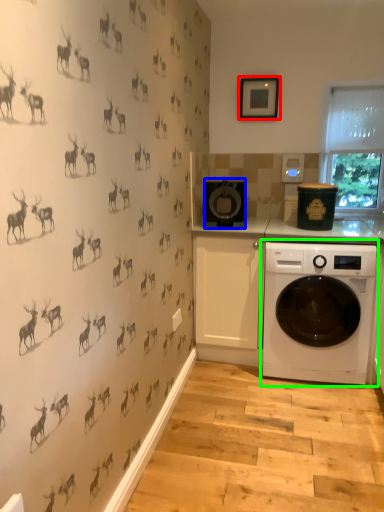
Question: Which object is positioned farthest from picture frame (highlighted by a red box)? Select from appliance (highlighted by a blue box) and washing machine (highlighted by a green box).

Choices:
 (A) appliance
 (B) washing machine

Answer: (B)